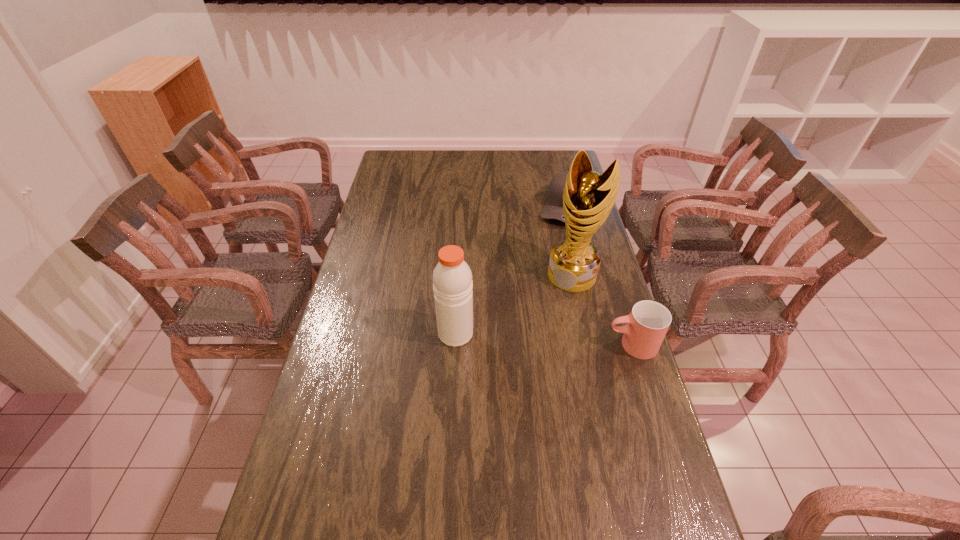
The width and height of the screenshot is (960, 540). In the image, there is a desktop. What are the coordinates of `vacant space at the left edge` in the screenshot? It's located at (369, 218).

Image resolution: width=960 pixels, height=540 pixels. Find the location of `vacant space at the right edge of the desktop`. vacant space at the right edge of the desktop is located at coordinates (668, 496).

Where is `free spot at the far left corner of the desktop`? Image resolution: width=960 pixels, height=540 pixels. free spot at the far left corner of the desktop is located at coordinates (394, 160).

In the image, there is a desktop. In order to click on blank space at the near left corner in this screenshot , I will do `click(279, 531)`.

You are a GUI agent. You are given a task and a screenshot of the screen. Output one action in this format:
    pyautogui.click(x=<x>, y=<y>)
    Task: Click on the free space at the far right corner of the desktop
    This screenshot has height=540, width=960.
    Given the screenshot: What is the action you would take?
    pyautogui.click(x=548, y=151)

The width and height of the screenshot is (960, 540). I want to click on free space between the cup and the leftmost object, so click(543, 339).

Locate an element on the screen. Image resolution: width=960 pixels, height=540 pixels. vacant area that lies between the second tallest object and the third nearest object is located at coordinates point(515,304).

Identify the location of free space between the cup and the farthest object. The width and height of the screenshot is (960, 540). (598, 276).

The width and height of the screenshot is (960, 540). Identify the location of vacant point located between the cup and the shaker. click(x=543, y=339).

This screenshot has height=540, width=960. What are the coordinates of `vacant space in between the shaker and the cup` in the screenshot? It's located at (543, 339).